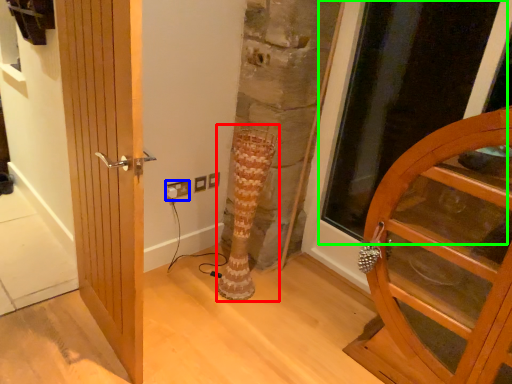
Question: Considering the real-world distances, which object is farthest from tree trunk (highlighted by a red box)? electric outlet (highlighted by a blue box) or glass door (highlighted by a green box)?

Choices:
 (A) electric outlet
 (B) glass door

Answer: (B)